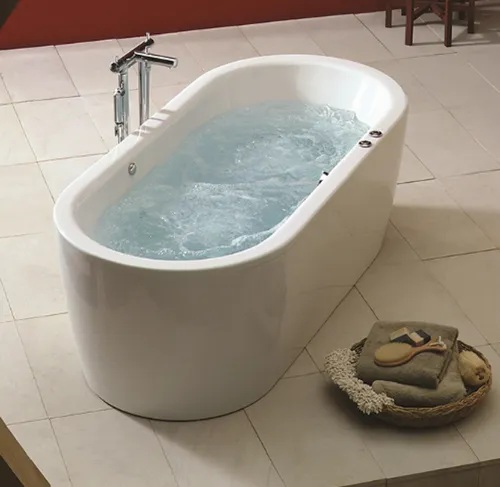
Where is `shadow from stool`? The width and height of the screenshot is (500, 487). shadow from stool is located at coordinates (483, 24).